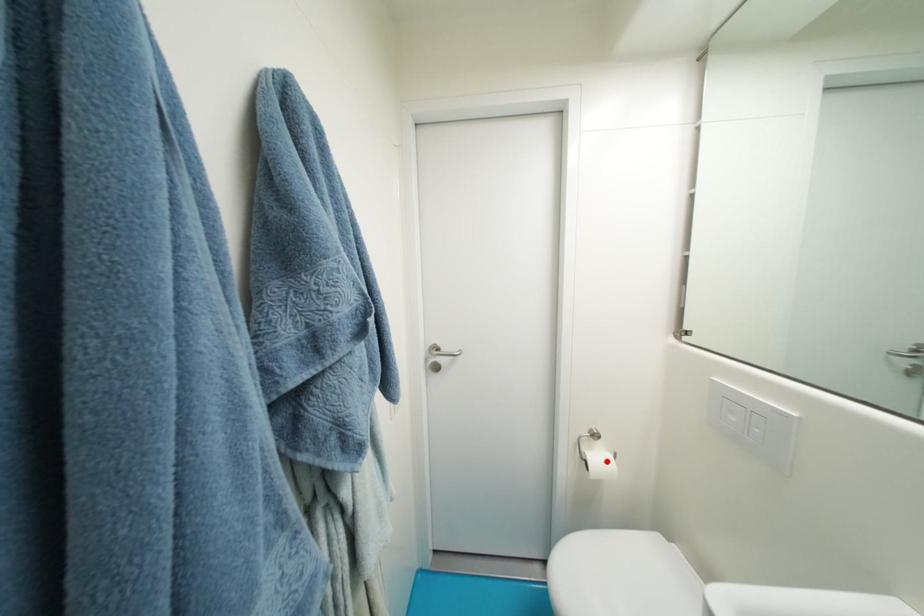
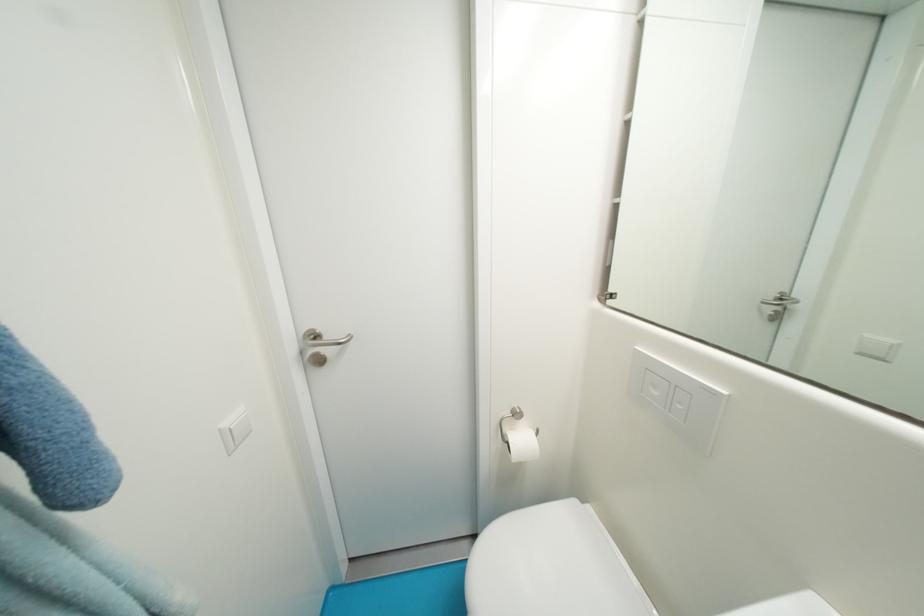
The point at the highlighted location is marked in the first image. Where is the corresponding point in the second image?

(529, 442)